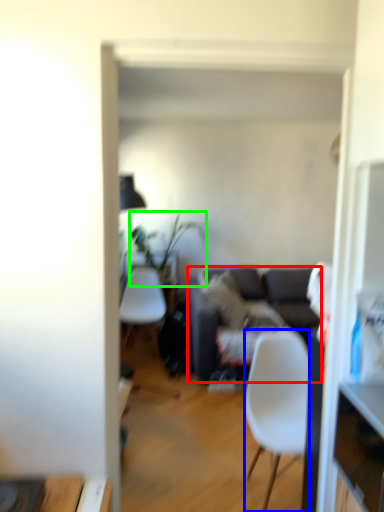
Question: Which is farther away from studio couch (highlighted by a red box)? chair (highlighted by a blue box) or houseplant (highlighted by a green box)?

Choices:
 (A) chair
 (B) houseplant

Answer: (A)